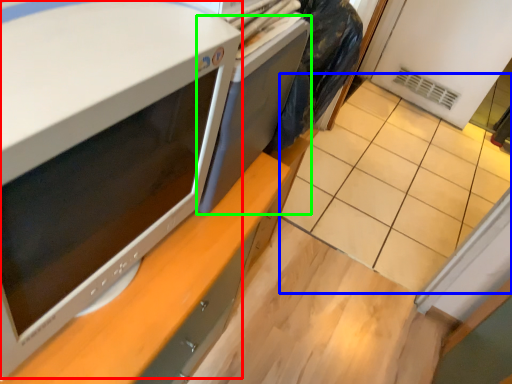
Question: Considering the real-world distances, which object is farthest from home appliance (highlighted by a red box)? tile (highlighted by a blue box) or desktop (highlighted by a green box)?

Choices:
 (A) tile
 (B) desktop

Answer: (A)